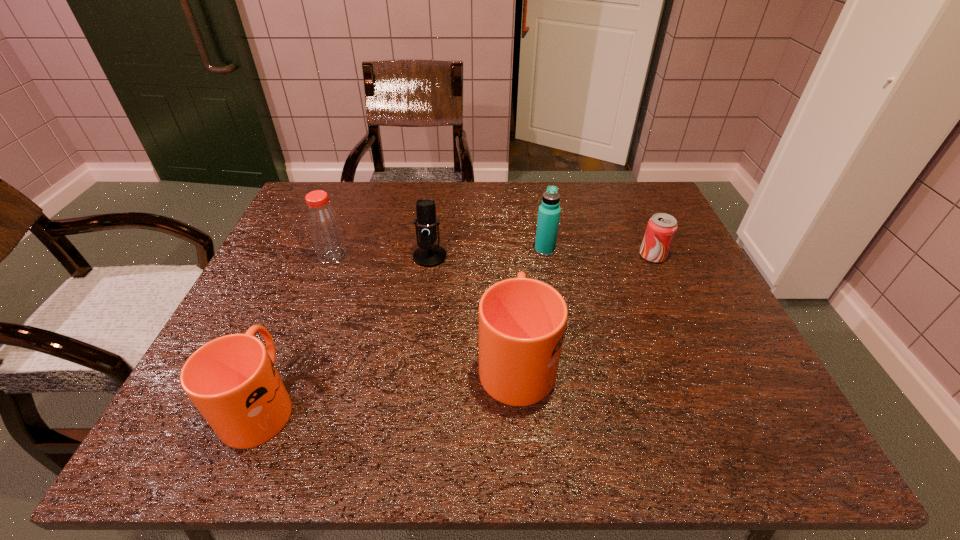
I want to click on vacant space located on the handle side of the right mug, so click(x=509, y=260).

This screenshot has width=960, height=540. Find the location of `free space located on the handle side of the right mug`. free space located on the handle side of the right mug is located at coordinates (507, 233).

Locate an element on the screen. The width and height of the screenshot is (960, 540). vacant space located 0.180m on the handle side of the right mug is located at coordinates (509, 267).

I want to click on free space located 0.050m on the front of the shortest object, so click(662, 277).

I want to click on free space located 0.340m on the back of the bottle, so click(x=361, y=183).

Where is `free space located on the front of the water bottle`? free space located on the front of the water bottle is located at coordinates (552, 294).

Locate an element on the screen. vacant space located 0.130m on the front of the fourth object from right to left is located at coordinates (423, 303).

You are a GUI agent. You are given a task and a screenshot of the screen. Output one action in this format:
    pyautogui.click(x=<x>, y=<y>)
    Task: Click on the mug present at the left edge
    Image resolution: width=960 pixels, height=540 pixels.
    Given the screenshot: What is the action you would take?
    pyautogui.click(x=232, y=380)

At what (x,y) coordinates should I click in order to perform the action: click on bottle at the left edge. Please return your answer as a coordinate pair (x, y). The image size is (960, 540). Looking at the image, I should click on (324, 226).

This screenshot has width=960, height=540. I want to click on object that is at the right edge, so 661,228.